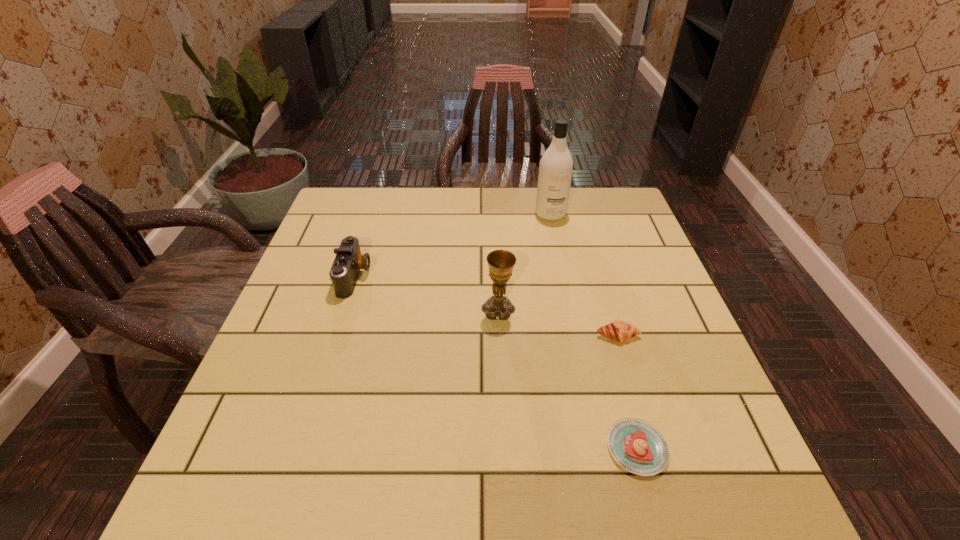
Image resolution: width=960 pixels, height=540 pixels. In order to click on shampoo in this screenshot , I will do `click(555, 172)`.

Identify the location of the farthest object. (555, 172).

You are a GUI agent. You are given a task and a screenshot of the screen. Output one action in this format:
    pyautogui.click(x=<x>, y=<y>)
    Task: Click on the chalice
    This screenshot has height=540, width=960.
    Given the screenshot: What is the action you would take?
    pyautogui.click(x=501, y=262)

Locate an element on the screen. The height and width of the screenshot is (540, 960). the second object from left to right is located at coordinates (501, 262).

At what (x,y) coordinates should I click in order to perform the action: click on the leftmost object. Please return your answer as a coordinate pair (x, y). The image size is (960, 540). Looking at the image, I should click on (345, 269).

Locate an element on the screen. Image resolution: width=960 pixels, height=540 pixels. the third shortest object is located at coordinates (345, 269).

Where is `the fourth farthest object`? the fourth farthest object is located at coordinates (619, 331).

At what (x,y) coordinates should I click in order to perform the action: click on the shortest object. Please return your answer as a coordinate pair (x, y). Image resolution: width=960 pixels, height=540 pixels. Looking at the image, I should click on (638, 447).

Locate an element on the screen. This screenshot has width=960, height=540. the nearest object is located at coordinates (638, 447).

Identify the location of blank space located on the front-facing side of the farthest object. (555, 234).